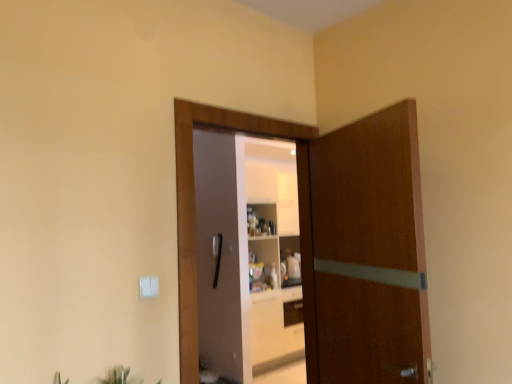
Question: From the image's perspective, is wooden door at center, the 1th door in the left-to-right sequence, under green leafy plant at lower center?

Choices:
 (A) yes
 (B) no

Answer: (B)

Question: Is wooden door at center, the 1th door in the left-to-right sequence, placed right next to green leafy plant at lower center?

Choices:
 (A) yes
 (B) no

Answer: (B)

Question: Does wooden door at center, the 1th door in the left-to-right sequence, have a lesser width compared to green leafy plant at lower center?

Choices:
 (A) yes
 (B) no

Answer: (A)

Question: Is green leafy plant at lower center completely or partially inside wooden door at center, the second door when ordered from right to left?

Choices:
 (A) yes
 (B) no

Answer: (B)

Question: Considering the relative sizes of wooden door at center, the 1th door in the left-to-right sequence, and green leafy plant at lower center in the image provided, is wooden door at center, the 1th door in the left-to-right sequence, bigger than green leafy plant at lower center?

Choices:
 (A) no
 (B) yes

Answer: (B)

Question: Is wooden door at center, the second door when ordered from right to left, positioned in front of green leafy plant at lower center?

Choices:
 (A) yes
 (B) no

Answer: (B)

Question: Is brown wooden door at center, which is the 1th door from right to left, completely or partially outside of wooden door at center, the second door when ordered from right to left?

Choices:
 (A) yes
 (B) no

Answer: (A)

Question: Does brown wooden door at center, the second door when ordered from left to right, have a greater width compared to wooden door at center, the second door when ordered from right to left?

Choices:
 (A) no
 (B) yes

Answer: (B)

Question: Is brown wooden door at center, the second door when ordered from left to right, smaller than wooden door at center, the second door when ordered from right to left?

Choices:
 (A) no
 (B) yes

Answer: (A)

Question: Is brown wooden door at center, the second door when ordered from left to right, facing away from wooden door at center, the 1th door in the left-to-right sequence?

Choices:
 (A) yes
 (B) no

Answer: (B)

Question: Does brown wooden door at center, the second door when ordered from left to right, have a greater height compared to wooden door at center, the 1th door in the left-to-right sequence?

Choices:
 (A) no
 (B) yes

Answer: (A)

Question: From a real-world perspective, is brown wooden door at center, which is the 1th door from right to left, beneath wooden door at center, the second door when ordered from right to left?

Choices:
 (A) yes
 (B) no

Answer: (A)

Question: Would you consider green leafy plant at lower center to be distant from brown wooden door at center, which is the 1th door from right to left?

Choices:
 (A) no
 (B) yes

Answer: (B)